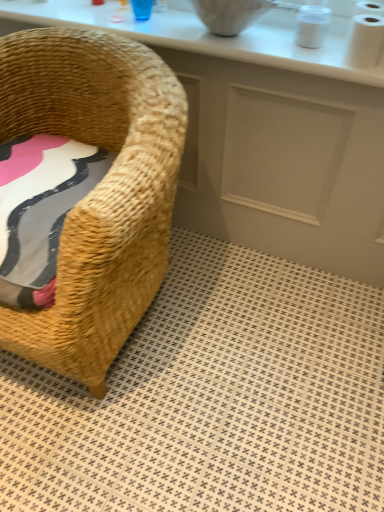
The image size is (384, 512). Describe the element at coordinates (97, 188) in the screenshot. I see `woven straw chair at left` at that location.

What do you see at coordinates (262, 139) in the screenshot? I see `white glossy counter at upper center` at bounding box center [262, 139].

Identify the location of white matte toilet paper at upper right. This screenshot has height=512, width=384. (366, 35).

At what (x,y) coordinates should I click in order to perform the action: click on woven straw chair at left. Please return your answer as a coordinate pair (x, y). The width and height of the screenshot is (384, 512). Looking at the image, I should click on (97, 188).

Could you tell me if white glossy counter at upper center is facing white glossy counter top at upper center?

No, white glossy counter at upper center is not oriented towards white glossy counter top at upper center.

Would you say white glossy counter at upper center is to the left or to the right of white glossy counter top at upper center in the picture?

In the image, white glossy counter at upper center appears on the right side of white glossy counter top at upper center.

Does point (310, 207) come closer to viewer compared to point (265, 40)?

No, it is behind (265, 40).

Is there a large distance between white glossy counter top at upper center and white glossy counter at upper center?

No, white glossy counter top at upper center is not far from white glossy counter at upper center.

Is white glossy counter top at upper center bigger or smaller than white glossy counter at upper center?

Clearly, white glossy counter top at upper center is smaller in size than white glossy counter at upper center.

Consider the image. Between white glossy counter top at upper center and white glossy counter at upper center, which one has more height?

white glossy counter at upper center.

Could you tell me if white glossy counter top at upper center is facing white glossy counter at upper center?

No, white glossy counter top at upper center is not facing towards white glossy counter at upper center.

Is point (73, 373) closer to camera compared to point (175, 48)?

Yes, point (73, 373) is closer to viewer.

From the image's perspective, is woven straw chair at left on top of white glossy counter top at upper center?

No.

Can you confirm if woven straw chair at left is shorter than white glossy counter top at upper center?

Incorrect, the height of woven straw chair at left does not fall short of that of white glossy counter top at upper center.

Based on their sizes in the image, would you say woven straw chair at left is bigger or smaller than white glossy counter top at upper center?

woven straw chair at left is bigger than white glossy counter top at upper center.

Is point (106, 349) closer to viewer compared to point (381, 9)?

Yes, it is in front of point (381, 9).

Choose the correct answer: Is woven straw chair at left inside white matte toilet paper at upper right or outside it?

woven straw chair at left exists outside the volume of white matte toilet paper at upper right.

Can you confirm if woven straw chair at left is positioned to the right of white matte toilet paper at upper right?

No, woven straw chair at left is not to the right of white matte toilet paper at upper right.

Looking at this image, measure the distance from white matte toilet paper at upper right to white glossy counter top at upper center.

They are 12.76 inches apart.

From the image's perspective, is white matte toilet paper at upper right positioned above or below white glossy counter top at upper center?

From the image's perspective, white matte toilet paper at upper right appears below white glossy counter top at upper center.

Is white matte toilet paper at upper right outside of white glossy counter top at upper center?

Yes, white matte toilet paper at upper right is outside of white glossy counter top at upper center.

What's the angular difference between white matte toilet paper at upper right and white glossy counter top at upper center's facing directions?

The facing directions of white matte toilet paper at upper right and white glossy counter top at upper center are 0.0149 degrees apart.

Can you confirm if white matte toilet paper at upper right is smaller than white glossy counter at upper center?

Yes, white matte toilet paper at upper right is smaller than white glossy counter at upper center.

This screenshot has height=512, width=384. I want to click on counter on the left of white matte toilet paper at upper right, so click(x=262, y=139).

Is white matte toilet paper at upper right directly adjacent to white glossy counter at upper center?

white matte toilet paper at upper right and white glossy counter at upper center are not in contact.

Does white glossy counter top at upper center lie in front of beige woven rug at lower left?

No, white glossy counter top at upper center is further to the viewer.

Is white glossy counter top at upper center turned away from beige woven rug at lower left?

No, beige woven rug at lower left is not at the back of white glossy counter top at upper center.

Would you say white glossy counter top at upper center is inside or outside beige woven rug at lower left?

The correct answer is: outside.

Considering the sizes of white glossy counter top at upper center and beige woven rug at lower left in the image, is white glossy counter top at upper center bigger or smaller than beige woven rug at lower left?

Considering their sizes, white glossy counter top at upper center takes up less space than beige woven rug at lower left.

Locate an element on the screen. The image size is (384, 512). counter top on the left of white glossy counter at upper center is located at coordinates (208, 36).

This screenshot has height=512, width=384. In order to click on counter top above the white glossy counter at upper center (from the image's perspective) in this screenshot , I will do `click(208, 36)`.

Which object lies further to the anchor point beige woven rug at lower left, white glossy counter at upper center or white matte toilet paper at upper right?

white matte toilet paper at upper right.

When comparing their distances from white matte toilet paper at upper right, does woven straw chair at left or beige woven rug at lower left seem closer?

The object closer to white matte toilet paper at upper right is woven straw chair at left.

Based on their spatial positions, is woven straw chair at left or white matte toilet paper at upper right closer to beige woven rug at lower left?

woven straw chair at left lies closer to beige woven rug at lower left than the other object.

Estimate the real-world distances between objects in this image. Which object is further from beige woven rug at lower left, woven straw chair at left or white glossy counter top at upper center?

The object further to beige woven rug at lower left is white glossy counter top at upper center.

Based on their spatial positions, is white matte toilet paper at upper right or beige woven rug at lower left closer to white glossy counter at upper center?

white matte toilet paper at upper right is positioned closer to the anchor white glossy counter at upper center.

Looking at the image, which one is located closer to white glossy counter at upper center, white matte toilet paper at upper right or white glossy counter top at upper center?

white glossy counter top at upper center is closer to white glossy counter at upper center.

Which object lies further to the anchor point white glossy counter top at upper center, white matte toilet paper at upper right or woven straw chair at left?

The object further to white glossy counter top at upper center is woven straw chair at left.

Looking at the image, which one is located closer to white matte toilet paper at upper right, beige woven rug at lower left or white glossy counter top at upper center?

white glossy counter top at upper center is positioned closer to the anchor white matte toilet paper at upper right.

Where is `counter top located between woven straw chair at left and white matte toilet paper at upper right in the left-right direction`? This screenshot has width=384, height=512. counter top located between woven straw chair at left and white matte toilet paper at upper right in the left-right direction is located at coordinates (208, 36).

Find the location of a particular element. This screenshot has width=384, height=512. counter that lies between white glossy counter top at upper center and woven straw chair at left from top to bottom is located at coordinates (262, 139).

Locate an element on the screen. This screenshot has height=512, width=384. chair between white glossy counter at upper center and beige woven rug at lower left vertically is located at coordinates click(97, 188).

At what (x,y) coordinates should I click in order to perform the action: click on counter located between woven straw chair at left and white matte toilet paper at upper right in the left-right direction. Please return your answer as a coordinate pair (x, y). Image resolution: width=384 pixels, height=512 pixels. Looking at the image, I should click on (262, 139).